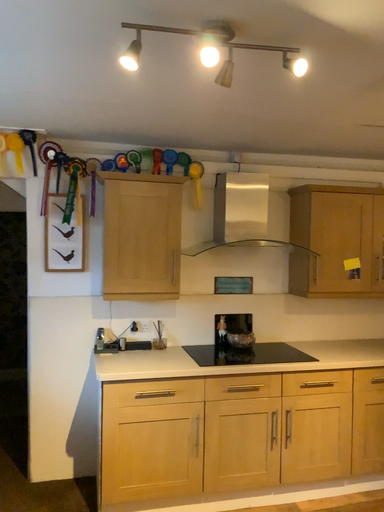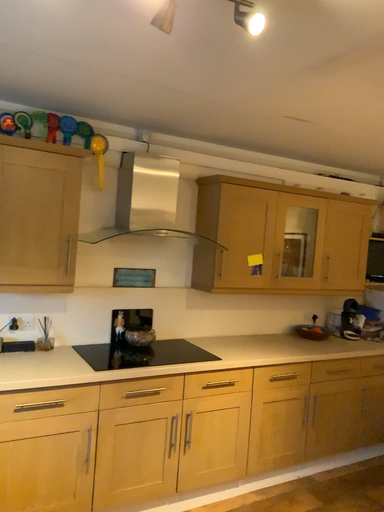
Question: Which way did the camera rotate in the video?

Choices:
 (A) rotated left
 (B) rotated right

Answer: (B)